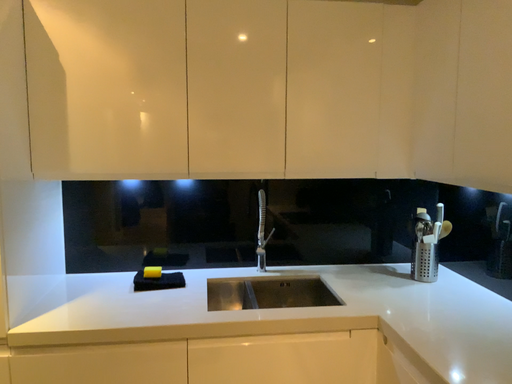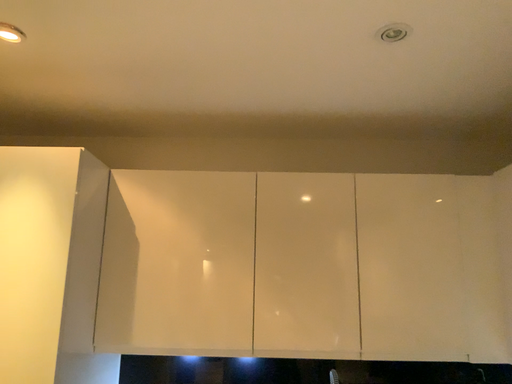
Question: Which way did the camera rotate in the video?

Choices:
 (A) rotated left
 (B) rotated right

Answer: (A)